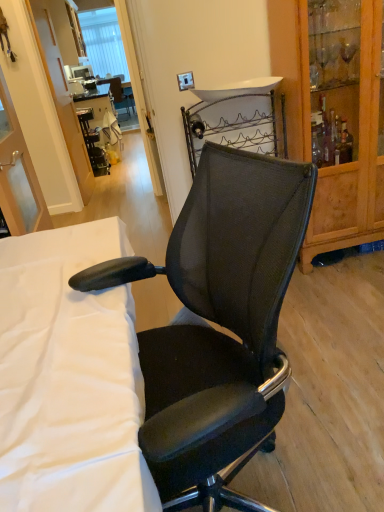
Question: From the image's perspective, is black mesh office chair at center located beneath black plastic table at center?

Choices:
 (A) yes
 (B) no

Answer: (A)

Question: Is black mesh office chair at center further to the viewer compared to black plastic table at center?

Choices:
 (A) no
 (B) yes

Answer: (A)

Question: Is black plastic table at center completely or partially inside black mesh office chair at center?

Choices:
 (A) yes
 (B) no

Answer: (B)

Question: Is black mesh office chair at center closer to the viewer compared to black plastic table at center?

Choices:
 (A) no
 (B) yes

Answer: (B)

Question: Does black mesh office chair at center have a lesser width compared to black plastic table at center?

Choices:
 (A) no
 (B) yes

Answer: (B)

Question: Is white fabric at center wider or thinner than wooden cabinet at right?

Choices:
 (A) wide
 (B) thin

Answer: (A)

Question: In the image, is white fabric at center positioned in front of or behind wooden cabinet at right?

Choices:
 (A) front
 (B) behind

Answer: (A)

Question: Is white fabric at center spatially inside wooden cabinet at right, or outside of it?

Choices:
 (A) inside
 (B) outside

Answer: (B)

Question: Is point (52, 453) closer or farther from the camera than point (370, 167)?

Choices:
 (A) farther
 (B) closer

Answer: (B)

Question: From the image's perspective, is black mesh office chair at center above or below white fabric at center?

Choices:
 (A) above
 (B) below

Answer: (A)

Question: Is point (251, 257) closer or farther from the camera than point (109, 219)?

Choices:
 (A) closer
 (B) farther

Answer: (A)

Question: Considering their positions, is black mesh office chair at center located in front of or behind white fabric at center?

Choices:
 (A) behind
 (B) front

Answer: (A)

Question: Is black mesh office chair at center spatially inside white fabric at center, or outside of it?

Choices:
 (A) inside
 (B) outside

Answer: (B)

Question: In the image, is black plastic table at center positioned in front of or behind wooden cabinet at right?

Choices:
 (A) behind
 (B) front

Answer: (A)

Question: Considering the positions of black plastic table at center and wooden cabinet at right in the image, is black plastic table at center wider or thinner than wooden cabinet at right?

Choices:
 (A) thin
 (B) wide

Answer: (B)